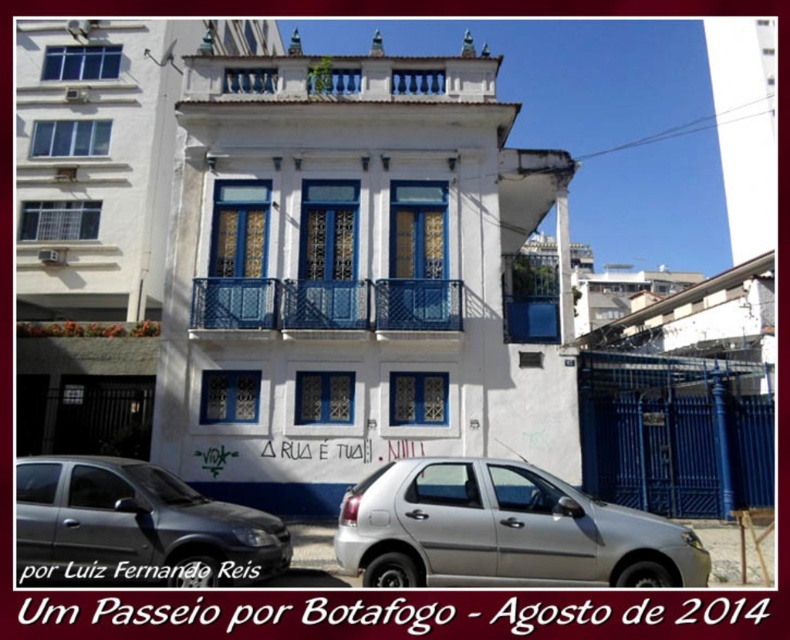
Question: Is satin silver car at lower left to the left of blue metal railing at center from the viewer's perspective?

Choices:
 (A) yes
 (B) no

Answer: (A)

Question: Which is farther from the satin silver car at lower left?

Choices:
 (A) silver metallic hatchback at center
 (B) blue metal railing at center

Answer: (B)

Question: Estimate the real-world distances between objects in this image. Which object is closer to the silver metallic hatchback at center?

Choices:
 (A) satin silver car at lower left
 (B) blue metal railing at center

Answer: (A)

Question: Can you confirm if silver metallic hatchback at center is thinner than blue metal railing at center?

Choices:
 (A) no
 (B) yes

Answer: (B)

Question: Which object is the farthest from the satin silver car at lower left?

Choices:
 (A) blue metal railing at center
 (B) silver metallic hatchback at center

Answer: (A)

Question: Does silver metallic hatchback at center come in front of satin silver car at lower left?

Choices:
 (A) no
 (B) yes

Answer: (B)